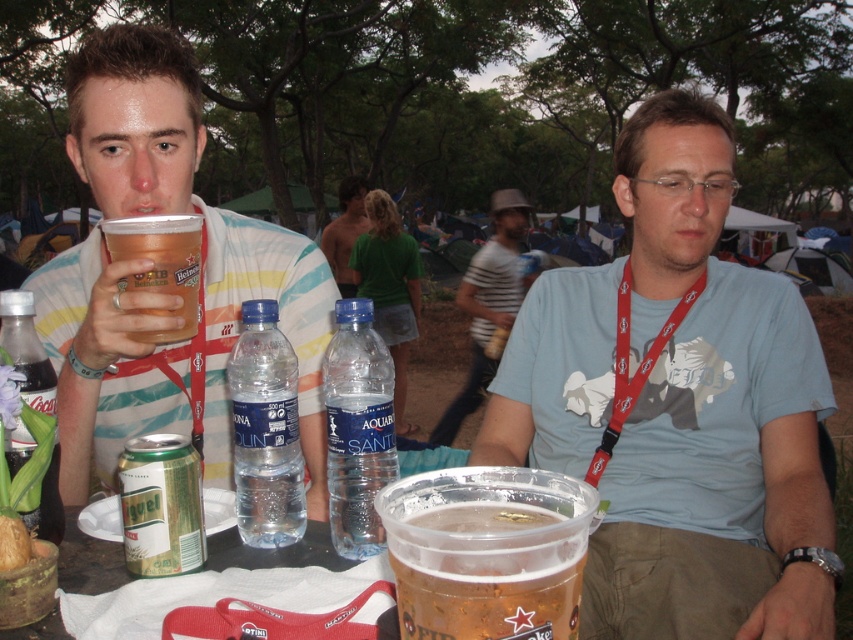
Question: Does green metallic can at lower left have a lesser width compared to brown textured bread at lower left?

Choices:
 (A) yes
 (B) no

Answer: (B)

Question: Estimate the real-world distances between objects in this image. Which object is farther from the translucent plastic cup at upper left?

Choices:
 (A) light blue cotton shirt at center
 (B) green metallic can at lower left
 (C) brown textured bread at lower left

Answer: (A)

Question: Is clear plastic bottle at center wider than clear plastic water bottle at center?

Choices:
 (A) yes
 (B) no

Answer: (B)

Question: Does striped cotton shirt at center come behind matte glass bottle at lower left?

Choices:
 (A) yes
 (B) no

Answer: (A)

Question: Which is nearer to the matte glass bottle at lower left?

Choices:
 (A) clear plastic water bottle at center
 (B) translucent plastic cup at upper left
 (C) green metallic can at lower left

Answer: (C)

Question: Which of the following is the closest to the observer?

Choices:
 (A) translucent plastic cup at upper left
 (B) translucent plastic cup at center
 (C) light blue cotton shirt at center

Answer: (B)